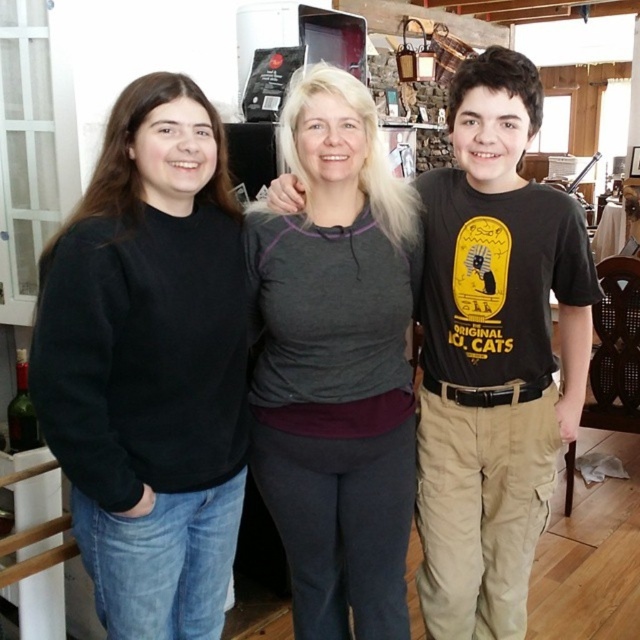
Question: Is black matte sweatshirt at left positioned in front of black cotton t-shirt at center?

Choices:
 (A) no
 (B) yes

Answer: (B)

Question: Based on their relative distances, which object is farther from the black cotton t-shirt at center?

Choices:
 (A) gray fleece at center
 (B) black matte sweatshirt at left

Answer: (B)

Question: Observing the image, what is the correct spatial positioning of black matte sweatshirt at left in reference to gray fleece at center?

Choices:
 (A) above
 (B) below

Answer: (B)

Question: Where is black matte sweatshirt at left located in relation to gray fleece at center in the image?

Choices:
 (A) above
 (B) below

Answer: (B)

Question: Which of these objects is positioned farthest from the gray fleece at center?

Choices:
 (A) black cotton t-shirt at center
 (B) black matte sweatshirt at left

Answer: (B)

Question: Which of the following is the closest to the observer?

Choices:
 (A) (417, 435)
 (B) (209, 397)
 (C) (285, 520)

Answer: (B)